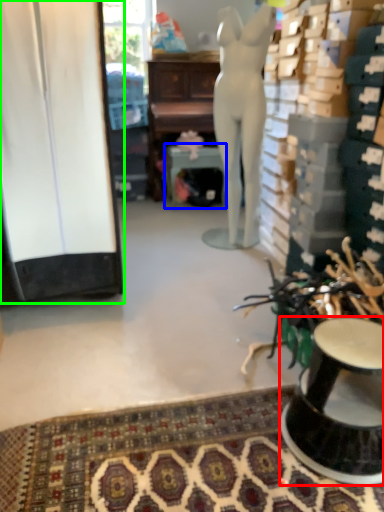
Question: Which object is the closest to the furniture (highlighted by a red box)? Choose among these: round table (highlighted by a blue box) or cabinetry (highlighted by a green box).

Choices:
 (A) round table
 (B) cabinetry

Answer: (B)